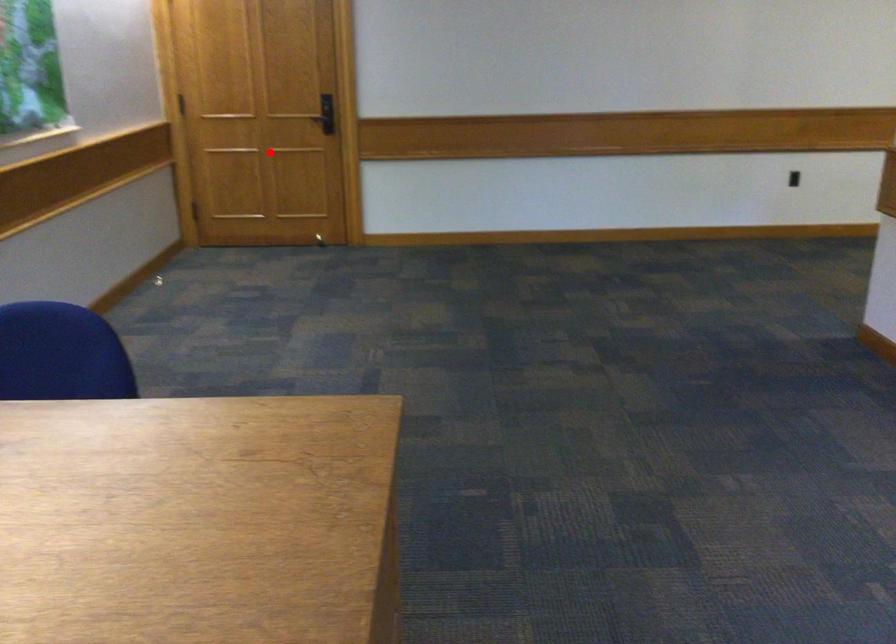
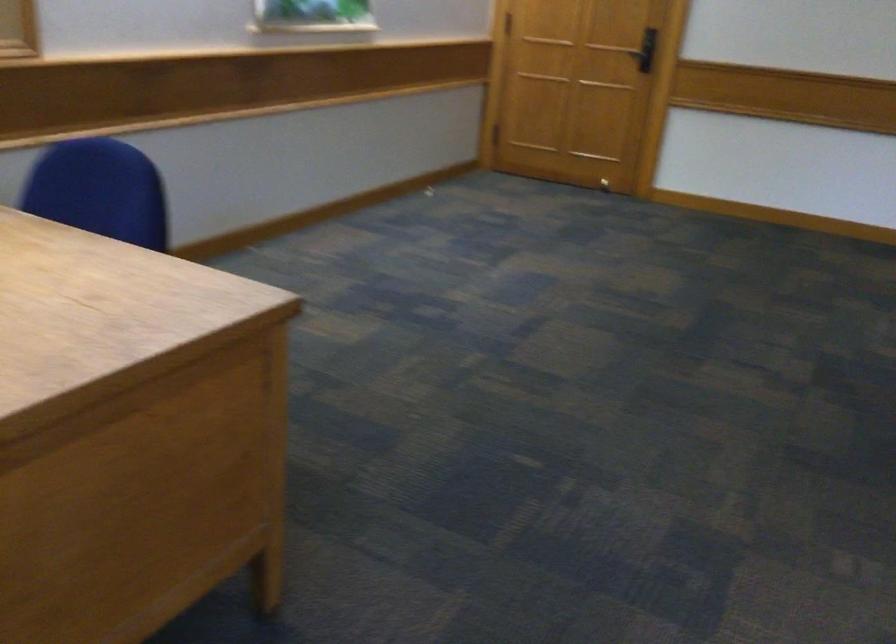
Locate, in the second image, the point that corresponds to the highlighted location in the first image.

(581, 89)